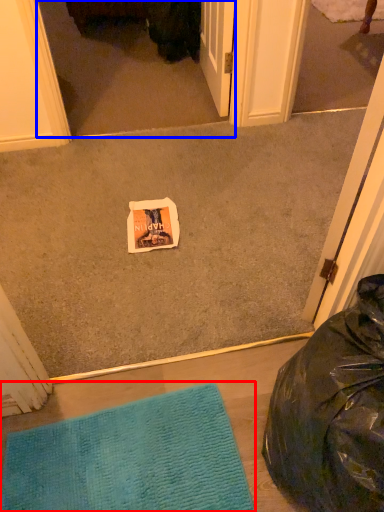
Question: Which of the following is the farthest to the observer, mat (highlighted by a red box) or screen door (highlighted by a blue box)?

Choices:
 (A) mat
 (B) screen door

Answer: (B)